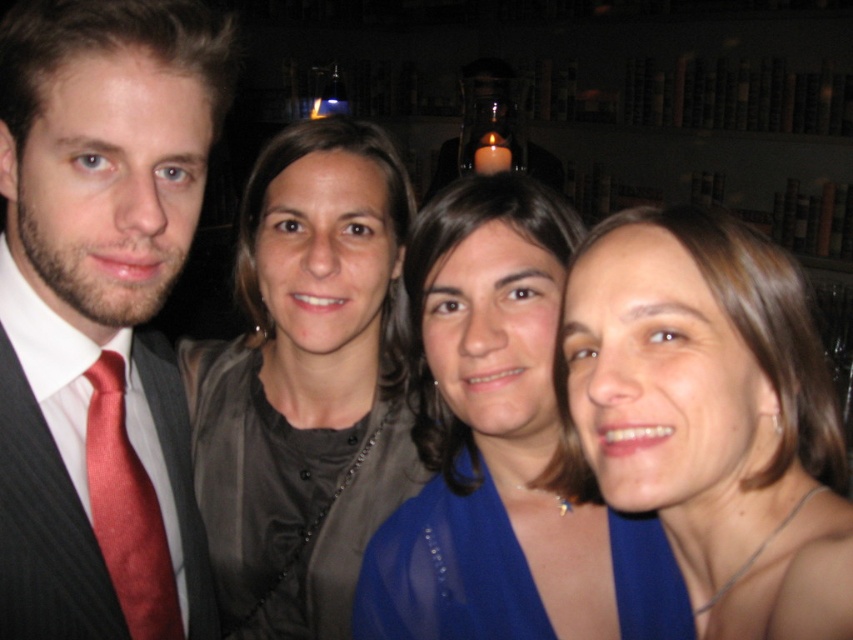
You are standing in front of a group photo taken in a library. You notice two items of clothing in the image. The first is the matte red tie at left, and the second is the matte gray blouse at center. Which of these two items is positioned closer to you?

The matte red tie at left is closer to the viewer than the matte gray blouse at center.